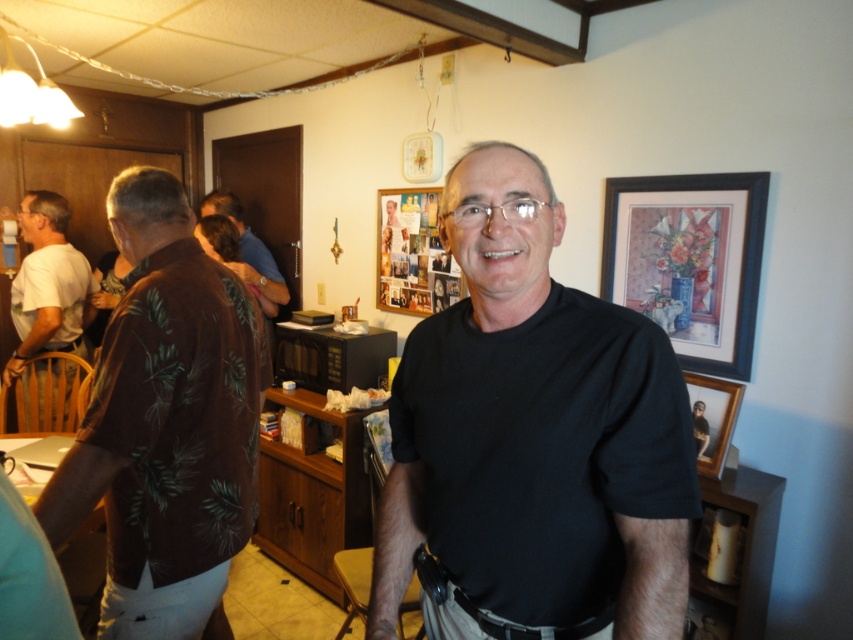
You are organizing a photo wall and need to know the relative sizes of the wooden picture frame at upper center and the brown floral shirt at center. Which object is larger?

The brown floral shirt at center is larger than the wooden picture frame at upper center.

You are a photographer setting up for a family portrait. You notice the black matte shirt at center and the brown floral shirt at center. Which shirt is closer to the camera?

The black matte shirt at center is positioned under the brown floral shirt at center, so the brown floral shirt at center is closer to the camera.